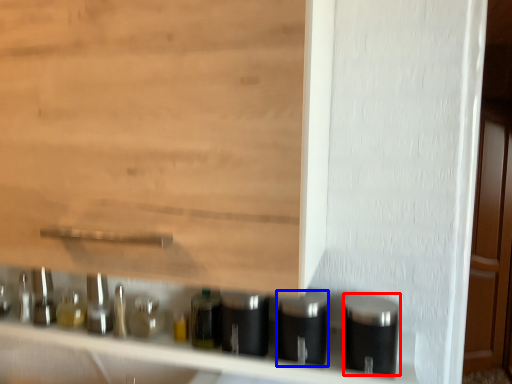
Question: Which point is further to the camera, silver (highlighted by a red box) or silver (highlighted by a blue box)?

Choices:
 (A) silver
 (B) silver

Answer: (B)